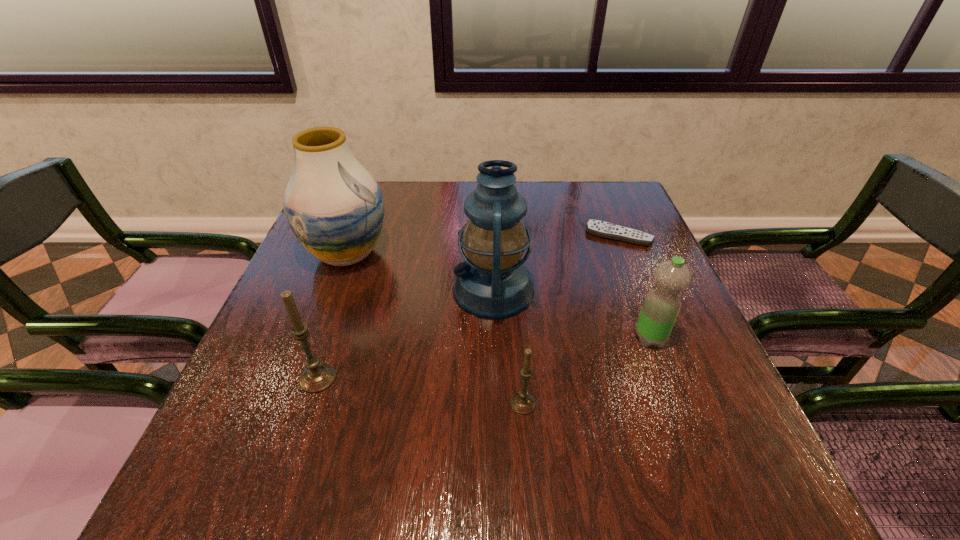
Where is `vacant area that lies between the vase and the fifth tallest object`? vacant area that lies between the vase and the fifth tallest object is located at coordinates (435, 329).

Find the location of a particular element. The height and width of the screenshot is (540, 960). unoccupied area between the vase and the lantern is located at coordinates (420, 272).

At what (x,y) coordinates should I click in order to perform the action: click on free spot between the lantern and the vase. Please return your answer as a coordinate pair (x, y). The width and height of the screenshot is (960, 540). Looking at the image, I should click on (420, 272).

Identify the location of vacant region between the remote control and the water bottle. (635, 287).

What are the coordinates of `vacant space that is in between the left candle and the vase` in the screenshot? It's located at point(332,316).

Locate an element on the screen. Image resolution: width=960 pixels, height=540 pixels. unoccupied position between the water bottle and the remote control is located at coordinates (635, 287).

In order to click on vacant point located between the vase and the right candle in this screenshot , I will do `click(435, 329)`.

Find the location of `object that ranks as the third closest to the lantern`. object that ranks as the third closest to the lantern is located at coordinates point(603,229).

Locate an element on the screen. The image size is (960, 540). the closest object to the shorter candle is located at coordinates (493, 283).

Identify the location of free space that satisfies the following two spatial constraints: 1. on the back side of the shortest object; 2. on the right side of the left candle. This screenshot has width=960, height=540. (366, 235).